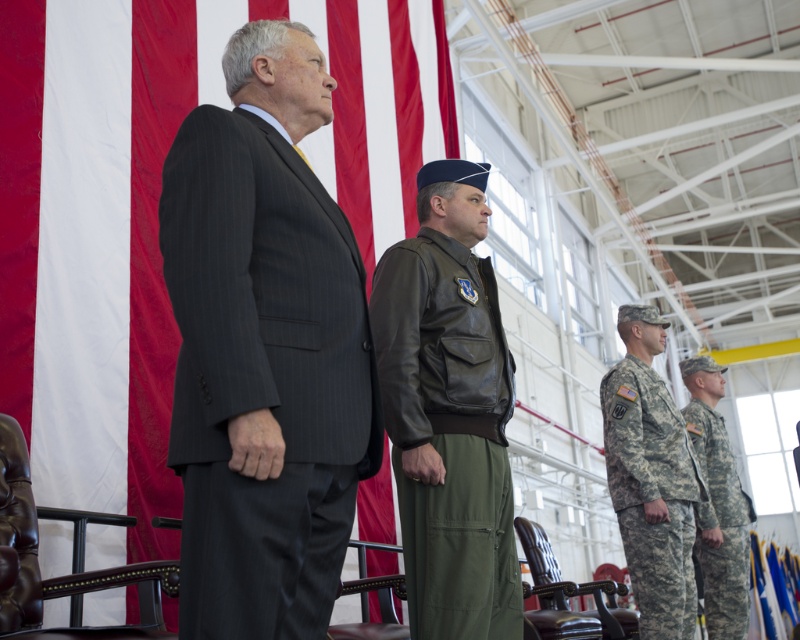
Based on the photo, which is above, red/white fabric flag at upper left or dark gray pinstripe suit at center?

red/white fabric flag at upper left is above.

Between red/white fabric flag at upper left and dark gray pinstripe suit at center, which one appears on the left side from the viewer's perspective?

red/white fabric flag at upper left is more to the left.

Which is in front, point (400, 612) or point (193, 282)?

Positioned in front is point (193, 282).

Identify the location of red/white fabric flag at upper left. The width and height of the screenshot is (800, 640). (156, 212).

You are a GUI agent. You are given a task and a screenshot of the screen. Output one action in this format:
    pyautogui.click(x=<x>, y=<y>)
    Task: Click on the red/white fabric flag at upper left
    This screenshot has width=800, height=640.
    Given the screenshot: What is the action you would take?
    pyautogui.click(x=156, y=212)

Does red/white fabric flag at upper left appear on the right side of camouflage uniform at right?

No, red/white fabric flag at upper left is not to the right of camouflage uniform at right.

What do you see at coordinates (156, 212) in the screenshot? I see `red/white fabric flag at upper left` at bounding box center [156, 212].

Where is `red/white fabric flag at upper left`? red/white fabric flag at upper left is located at coordinates (156, 212).

Is point (140, 349) closer to viewer compared to point (736, 618)?

Yes, point (140, 349) is closer to viewer.

Who is more distant from viewer, (148,413) or (728,620)?

Point (728,620)

Find the location of a particular element. This screenshot has width=800, height=640. red/white fabric flag at upper left is located at coordinates (156, 212).